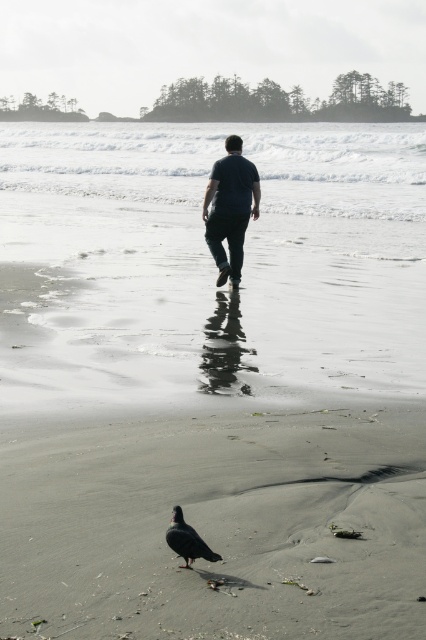
You are standing on the beach and see two points marked on the sand. The first point is at coordinates point (154, 504) and the second is at point (218, 193). Which point is closer to you?

Point (154, 504) is closer to the viewer than point (218, 193).

You are a photographer trying to capture the black feathered pigeon at lower center and the gray sand at center in a single shot. Which object should you focus on first if you want to ensure both are in frame without moving the camera?

You should focus on the gray sand at center first because it is larger than the black feathered pigeon at lower center, allowing you to frame it properly while still including the smaller pigeon in the shot.

You are a photographer trying to capture the black feathered pigeon at lower center and the gray sand at center in the same frame. Based on their positions, which object should you focus on first to ensure both are in the shot?

The gray sand at center is to the right of the black feathered pigeon at lower center, so you should focus on the black feathered pigeon at lower center first to ensure both are in the shot.